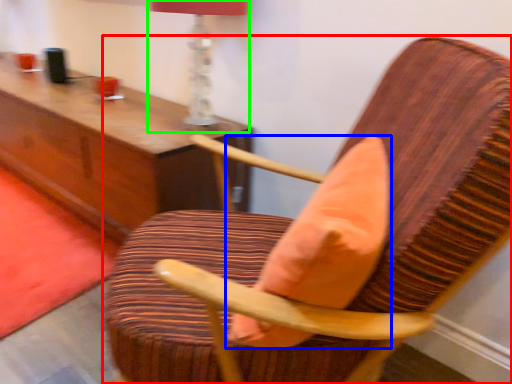
Question: Estimate the real-world distances between objects in this image. Which object is closer to chair (highlighted by a red box), throw pillow (highlighted by a blue box) or table lamp (highlighted by a green box)?

Choices:
 (A) throw pillow
 (B) table lamp

Answer: (A)